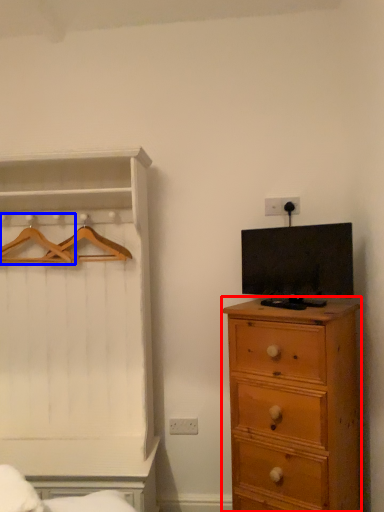
Question: Which of the following is the farthest to the observer, chest of drawers (highlighted by a red box) or hanger (highlighted by a blue box)?

Choices:
 (A) chest of drawers
 (B) hanger

Answer: (B)